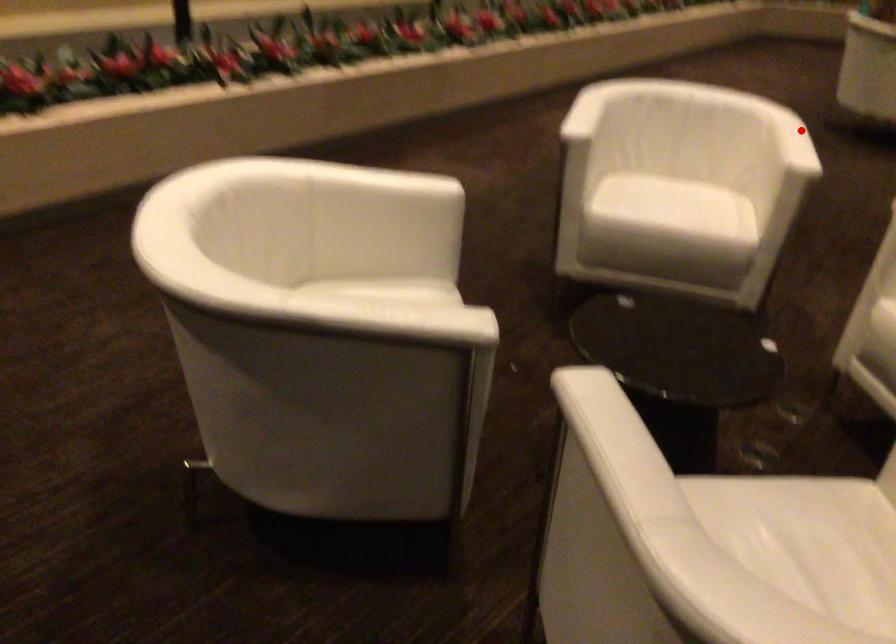
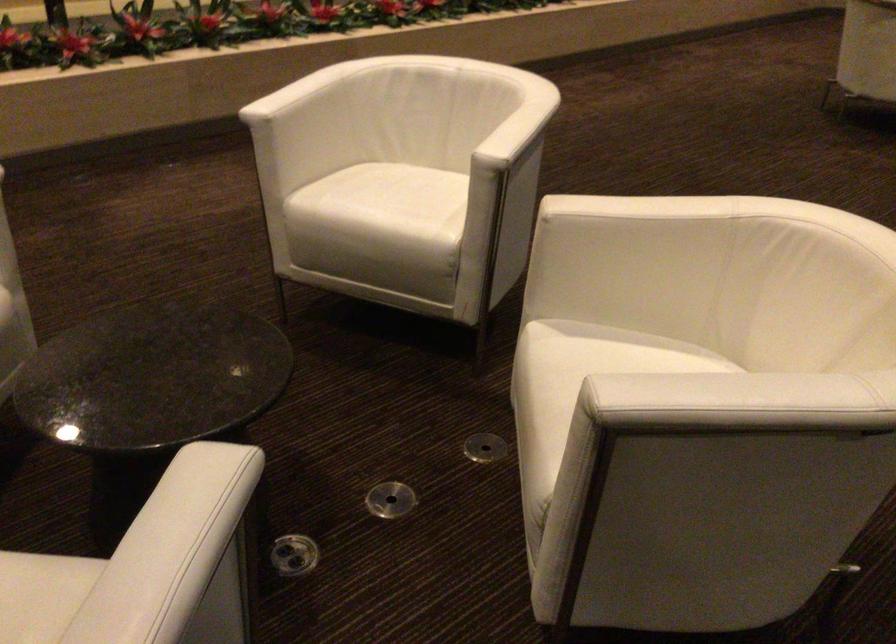
Question: I am providing you with two images of the same scene from different viewpoints. A red point is shown in image1. For the corresponding object point in image2, is it positioned nearer or farther from the camera?

Choices:
 (A) Nearer
 (B) Farther

Answer: (A)